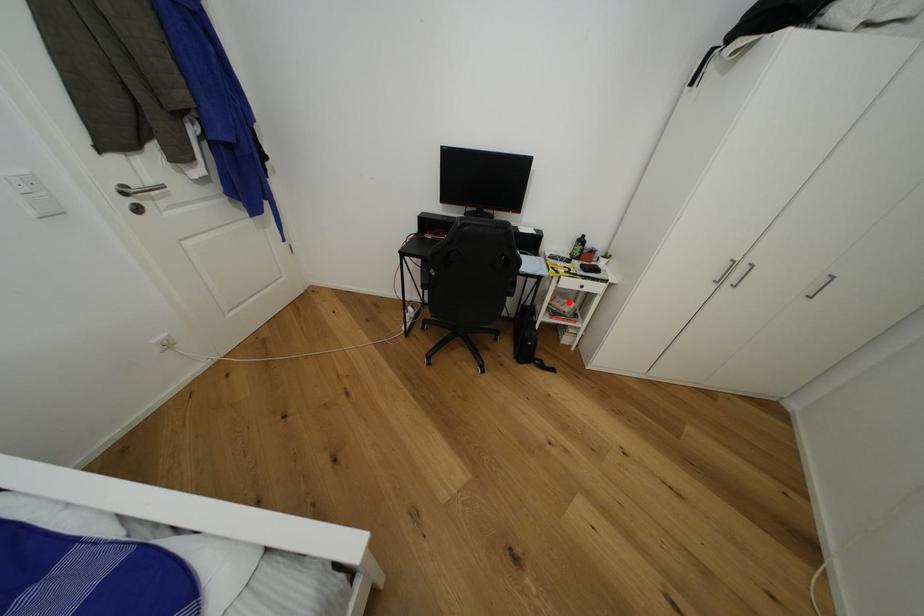
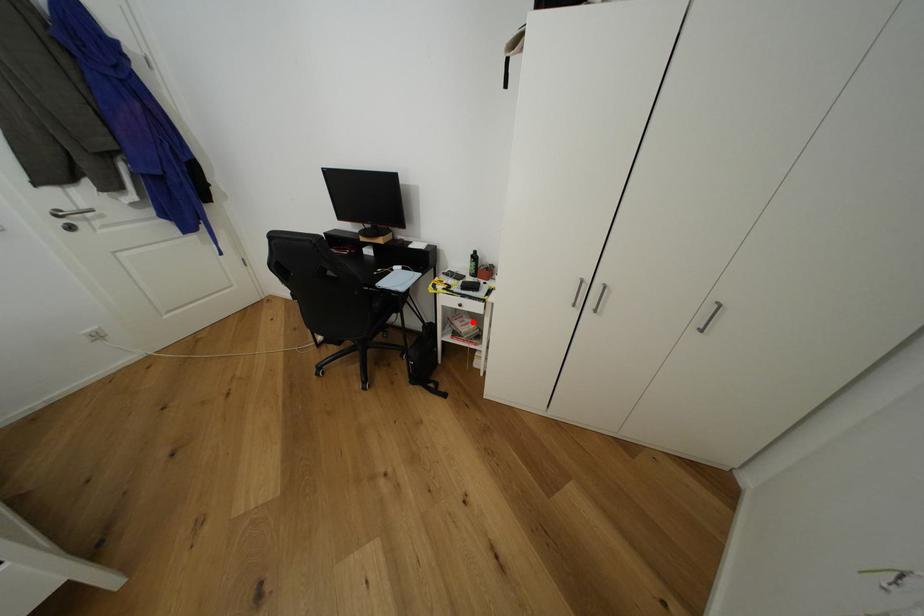
I am providing you with two images of the same scene from different viewpoints. A red point is marked on the first image and another point is marked on the second image. Does the point marked in image1 correspond to the same location as the one in image2?

Yes